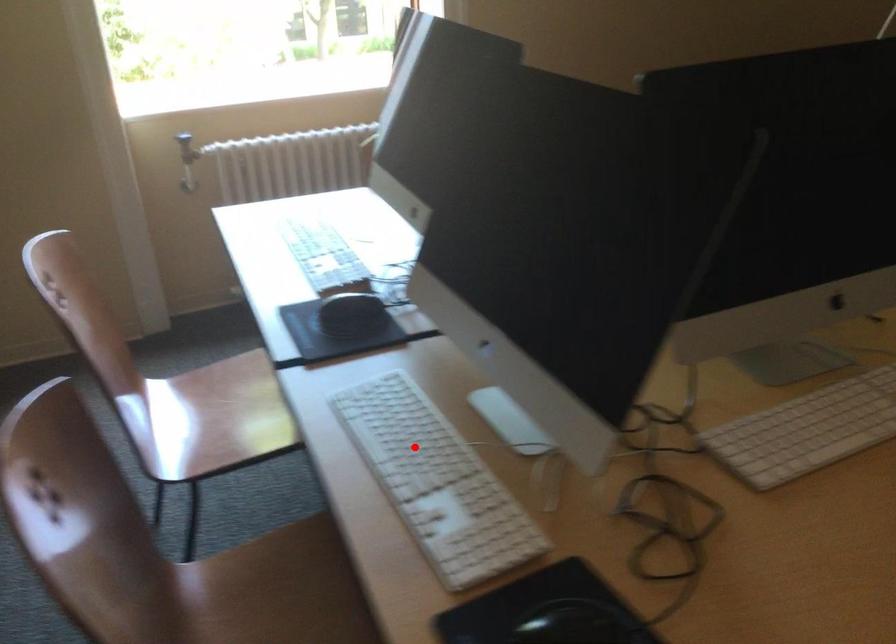
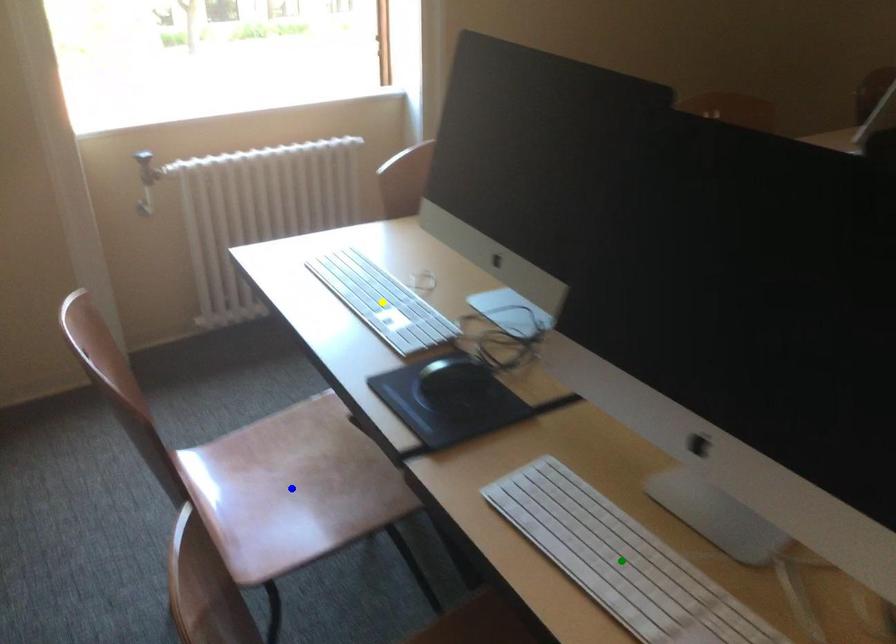
Question: I am providing you with two images of the same scene from different viewpoints. A red point is marked on the first image. You are given multiple points on the second image. Which spot in image 2 lines up with the point in image 1?

Choices:
 (A) yellow point
 (B) green point
 (C) blue point

Answer: (B)